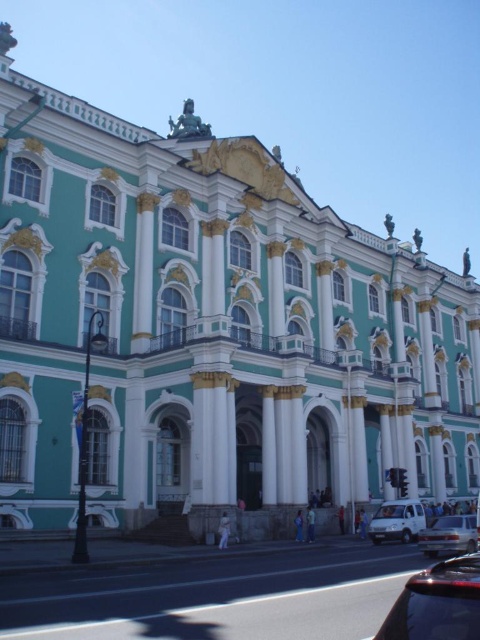
Is point (463, 625) more distant than point (432, 545)?

No, it is in front of (432, 545).

Is shiny black car at lower right to the right of silver metallic sedan at lower right from the viewer's perspective?

Incorrect, shiny black car at lower right is not on the right side of silver metallic sedan at lower right.

This screenshot has width=480, height=640. Describe the element at coordinates (437, 602) in the screenshot. I see `shiny black car at lower right` at that location.

Where is `shiny black car at lower right`? The image size is (480, 640). shiny black car at lower right is located at coordinates (437, 602).

Who is more distant from viewer, (441, 531) or (394, 536)?

Point (394, 536)

Who is more forward, (432, 520) or (399, 506)?

Point (399, 506) is more forward.

Identify the location of silver metallic sedan at lower right. (448, 536).

This screenshot has height=640, width=480. What do you see at coordinates (437, 602) in the screenshot?
I see `shiny black car at lower right` at bounding box center [437, 602].

Is point (477, 634) more distant than point (408, 515)?

No, (477, 634) is closer to viewer.

Between point (416, 632) and point (400, 529), which one is positioned behind?

The point (400, 529) is behind.

At what (x,y) coordinates should I click in order to perform the action: click on shiny black car at lower right. Please return your answer as a coordinate pair (x, y). Image resolution: width=480 pixels, height=640 pixels. Looking at the image, I should click on (437, 602).